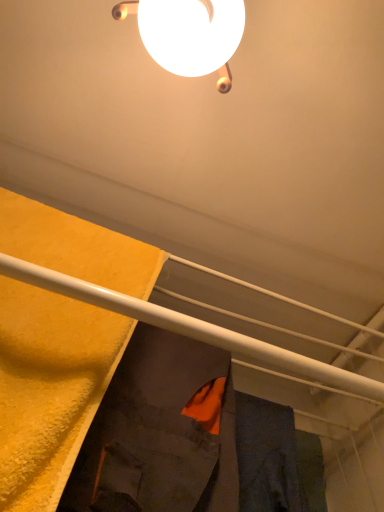
Question: From the image's perspective, is orange fabric at center, marked as the first robe in a right-to-left arrangement, located above or below white glossy lamp at upper center?

Choices:
 (A) above
 (B) below

Answer: (B)

Question: Would you say orange fabric at center, the second robe positioned from the left, is inside or outside white glossy lamp at upper center?

Choices:
 (A) outside
 (B) inside

Answer: (A)

Question: Estimate the real-world distances between objects in this image. Which object is closer to the white glossy lamp at upper center?

Choices:
 (A) orange fabric at center, marked as the first robe in a right-to-left arrangement
 (B) dark gray fabric robe at center, the 2th robe from the right

Answer: (B)

Question: Based on their relative distances, which object is nearer to the dark gray fabric robe at center, the 2th robe from the right?

Choices:
 (A) orange fabric at center, the second robe positioned from the left
 (B) white glossy lamp at upper center

Answer: (A)